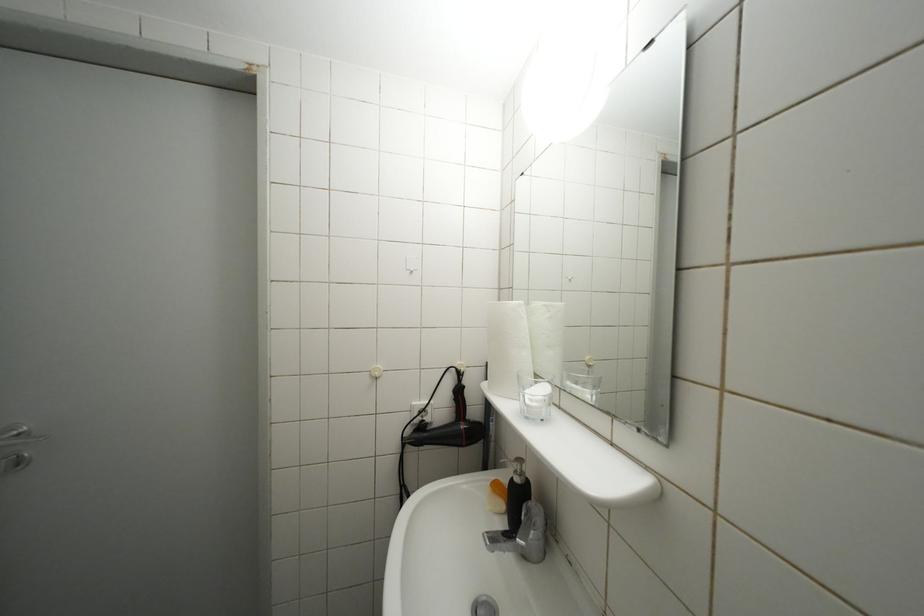
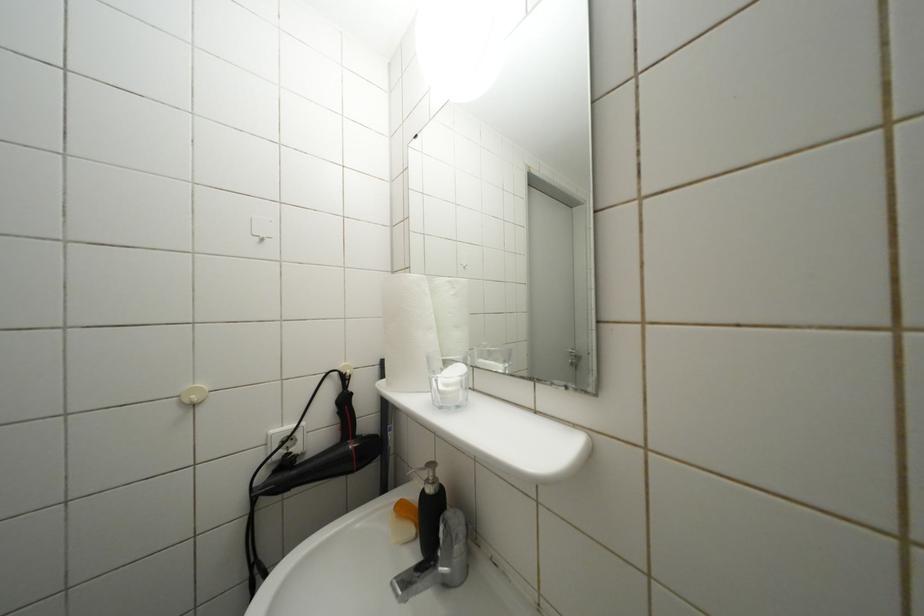
Question: The first image is from the beginning of the video and the second image is from the end. How did the camera likely rotate when shooting the video?

Choices:
 (A) Left
 (B) Right
 (C) Up
 (D) Down

Answer: (B)